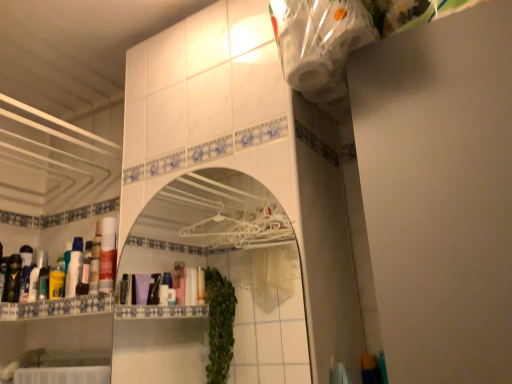
Image resolution: width=512 pixels, height=384 pixels. What do you see at coordinates (73, 274) in the screenshot? I see `white glossy bottle at left, which appears as the second mouthwash when viewed from the left` at bounding box center [73, 274].

Describe the element at coordinates (37, 275) in the screenshot. This screenshot has height=384, width=512. I see `white glossy bottle at left, arranged as the third toiletry when viewed from the left` at that location.

Where is `white plastic mirror at center`? white plastic mirror at center is located at coordinates (233, 264).

Can you tell me how much metallic gold toiletry at left, which is counted as the 1th toiletry, starting from the left, and yellow glossy mouthwash at left, which is counted as the 3th mouthwash, starting from the right, differ in facing direction?

89.7 degrees.

Consider the image. From the image's perspective, which object appears higher, metallic gold toiletry at left, the third toiletry positioned from the right, or yellow glossy mouthwash at left, marked as the first mouthwash in a left-to-right arrangement?

metallic gold toiletry at left, the third toiletry positioned from the right, from the image's perspective.

Between point (17, 273) and point (54, 272), which one is positioned behind?

The point (17, 273) is farther.

Based on the photo, is metallic gold toiletry at left, the third toiletry positioned from the right, not inside yellow glossy mouthwash at left, which is counted as the 3th mouthwash, starting from the right?

Absolutely, metallic gold toiletry at left, the third toiletry positioned from the right, is external to yellow glossy mouthwash at left, which is counted as the 3th mouthwash, starting from the right.

Is white plastic mirror at center directly adjacent to metallic gold toiletry at left, the third toiletry positioned from the right?

No, white plastic mirror at center is not next to metallic gold toiletry at left, the third toiletry positioned from the right.

The height and width of the screenshot is (384, 512). I want to click on mirror to the right of metallic gold toiletry at left, which is counted as the 1th toiletry, starting from the left, so (233, 264).

Is point (279, 329) in front of point (19, 290)?

No, it is behind (19, 290).

Can you see yellow glossy mouthwash at left, marked as the first mouthwash in a left-to-right arrangement, touching matte black lotion at left, which is the 2th toiletry from left to right?

They are not placed beside each other.

Considering the sizes of objects yellow glossy mouthwash at left, which is counted as the 3th mouthwash, starting from the right, and matte black lotion at left, which is the 2th toiletry from left to right, in the image provided, who is wider, yellow glossy mouthwash at left, which is counted as the 3th mouthwash, starting from the right, or matte black lotion at left, which is the 2th toiletry from left to right,?

matte black lotion at left, which is the 2th toiletry from left to right.

Does point (61, 276) lie behind point (27, 273)?

No, (61, 276) is in front of (27, 273).

Does yellow glossy mouthwash at left, which is counted as the 3th mouthwash, starting from the right, turn towards matte black lotion at left, which is the 2th toiletry from left to right?

No, yellow glossy mouthwash at left, which is counted as the 3th mouthwash, starting from the right, is not aimed at matte black lotion at left, which is the 2th toiletry from left to right.

From a real-world perspective, between white plastic mirror at center and white glossy bottle at left, which is counted as the 2th mouthwash, starting from the right, who is vertically higher?

white glossy bottle at left, which is counted as the 2th mouthwash, starting from the right.

From the image's perspective, is white plastic mirror at center located above white glossy bottle at left, which appears as the second mouthwash when viewed from the left?

Correct, white plastic mirror at center appears higher than white glossy bottle at left, which appears as the second mouthwash when viewed from the left, in the image.

Consider the image. Does white plastic mirror at center turn towards white glossy bottle at left, which is counted as the 2th mouthwash, starting from the right?

No.

Considering the sizes of objects white plastic mirror at center and white glossy bottle at left, which is counted as the 2th mouthwash, starting from the right, in the image provided, who is taller, white plastic mirror at center or white glossy bottle at left, which is counted as the 2th mouthwash, starting from the right,?

white plastic mirror at center.

Locate an element on the screen. toiletry below the metallic gold toiletry at left, the third toiletry positioned from the right (from the image's perspective) is located at coordinates (37, 275).

From their relative heights in the image, would you say white glossy bottle at left, arranged as the third toiletry when viewed from the left, is taller or shorter than metallic gold toiletry at left, the third toiletry positioned from the right?

In the image, white glossy bottle at left, arranged as the third toiletry when viewed from the left, appears to be shorter than metallic gold toiletry at left, the third toiletry positioned from the right.

Is white glossy bottle at left, marked as the first toiletry in a right-to-left arrangement, oriented towards metallic gold toiletry at left, which is counted as the 1th toiletry, starting from the left?

No, white glossy bottle at left, marked as the first toiletry in a right-to-left arrangement, is not facing towards metallic gold toiletry at left, which is counted as the 1th toiletry, starting from the left.

Does white glossy bottle at left, marked as the first toiletry in a right-to-left arrangement, have a larger size compared to metallic gold toiletry at left, which is counted as the 1th toiletry, starting from the left?

Actually, white glossy bottle at left, marked as the first toiletry in a right-to-left arrangement, might be smaller than metallic gold toiletry at left, which is counted as the 1th toiletry, starting from the left.

From the image's perspective, is matte black lotion at left, which is the 2th toiletry from left to right, located beneath translucent plastic mouthwash at left, which is counted as the first mouthwash, starting from the right?

Yes, from the image's perspective, matte black lotion at left, which is the 2th toiletry from left to right, is beneath translucent plastic mouthwash at left, which is counted as the first mouthwash, starting from the right.

Is matte black lotion at left, which is the 2th toiletry from left to right, to the left of translucent plastic mouthwash at left, the third mouthwash viewed from the left, from the viewer's perspective?

Yes.

Are matte black lotion at left, which is the 2th toiletry from left to right, and translucent plastic mouthwash at left, the third mouthwash viewed from the left, making contact?

No, matte black lotion at left, which is the 2th toiletry from left to right, is not touching translucent plastic mouthwash at left, the third mouthwash viewed from the left.

Consider the image. Is matte black lotion at left, marked as the 2th toiletry in a right-to-left arrangement, not inside translucent plastic mouthwash at left, the third mouthwash viewed from the left?

Yes, matte black lotion at left, marked as the 2th toiletry in a right-to-left arrangement, is not within translucent plastic mouthwash at left, the third mouthwash viewed from the left.

Can you confirm if translucent plastic mouthwash at left, the third mouthwash viewed from the left, is thinner than white plastic mirror at center?

Incorrect, the width of translucent plastic mouthwash at left, the third mouthwash viewed from the left, is not less than that of white plastic mirror at center.

From the image's perspective, which is above, translucent plastic mouthwash at left, which is counted as the first mouthwash, starting from the right, or white plastic mirror at center?

white plastic mirror at center is shown above in the image.

Who is shorter, translucent plastic mouthwash at left, the third mouthwash viewed from the left, or white plastic mirror at center?

Standing shorter between the two is translucent plastic mouthwash at left, the third mouthwash viewed from the left.

Where is `the 1st mouthwash in front of the metallic gold toiletry at left, the third toiletry positioned from the right, starting your count from the anchor`? The height and width of the screenshot is (384, 512). the 1st mouthwash in front of the metallic gold toiletry at left, the third toiletry positioned from the right, starting your count from the anchor is located at coordinates (56, 282).

Image resolution: width=512 pixels, height=384 pixels. I want to click on the 2nd toiletry below the white plastic mirror at center (from the image's perspective), so click(12, 279).

Considering their positions, is translucent plastic mouthwash at left, which is counted as the first mouthwash, starting from the right, positioned further to matte black lotion at left, which is the 2th toiletry from left to right, than white glossy bottle at left, which appears as the second mouthwash when viewed from the left?

Based on the image, translucent plastic mouthwash at left, which is counted as the first mouthwash, starting from the right, appears to be further to matte black lotion at left, which is the 2th toiletry from left to right.

Which object lies further to the anchor point white glossy bottle at left, which is counted as the 2th mouthwash, starting from the right, matte black lotion at left, marked as the 2th toiletry in a right-to-left arrangement, or white glossy cabinet at lower center?

Among the two, matte black lotion at left, marked as the 2th toiletry in a right-to-left arrangement, is located further to white glossy bottle at left, which is counted as the 2th mouthwash, starting from the right.

In the scene shown: Looking at the image, which one is located further to translucent plastic mouthwash at left, which is counted as the first mouthwash, starting from the right, metallic gold toiletry at left, the third toiletry positioned from the right, or white glossy bottle at left, arranged as the third toiletry when viewed from the left?

metallic gold toiletry at left, the third toiletry positioned from the right, is positioned further to the anchor translucent plastic mouthwash at left, which is counted as the first mouthwash, starting from the right.

Which object lies further to the anchor point white plastic mirror at center, white glossy cabinet at lower center or white glossy bottle at left, arranged as the third toiletry when viewed from the left?

white glossy cabinet at lower center lies further to white plastic mirror at center than the other object.

Which object lies further to the anchor point metallic gold toiletry at left, the third toiletry positioned from the right, matte black lotion at left, marked as the 2th toiletry in a right-to-left arrangement, or white glossy bottle at left, marked as the first toiletry in a right-to-left arrangement?

white glossy bottle at left, marked as the first toiletry in a right-to-left arrangement.

Based on their spatial positions, is white glossy cabinet at lower center or yellow glossy mouthwash at left, marked as the first mouthwash in a left-to-right arrangement, closer to white glossy bottle at left, which is counted as the 2th mouthwash, starting from the right?

The object closer to white glossy bottle at left, which is counted as the 2th mouthwash, starting from the right, is yellow glossy mouthwash at left, marked as the first mouthwash in a left-to-right arrangement.

Which object lies nearer to the anchor point white plastic mirror at center, yellow glossy mouthwash at left, which is counted as the 3th mouthwash, starting from the right, or translucent plastic mouthwash at left, which is counted as the first mouthwash, starting from the right?

translucent plastic mouthwash at left, which is counted as the first mouthwash, starting from the right, is positioned closer to the anchor white plastic mirror at center.

Looking at the image, which one is located closer to white glossy bottle at left, which is counted as the 2th mouthwash, starting from the right, white plastic mirror at center or translucent plastic mouthwash at left, the third mouthwash viewed from the left?

The object closer to white glossy bottle at left, which is counted as the 2th mouthwash, starting from the right, is translucent plastic mouthwash at left, the third mouthwash viewed from the left.

Where is `mouthwash located between matte black lotion at left, which is the 2th toiletry from left to right, and white glossy cabinet at lower center in the left-right direction`? This screenshot has width=512, height=384. mouthwash located between matte black lotion at left, which is the 2th toiletry from left to right, and white glossy cabinet at lower center in the left-right direction is located at coordinates (56, 282).

The image size is (512, 384). I want to click on mouthwash between white plastic mirror at center and white glossy bottle at left, which appears as the second mouthwash when viewed from the left, in the front-back direction, so click(108, 255).

At what (x,y) coordinates should I click in order to perform the action: click on cabinet located between metallic gold toiletry at left, the third toiletry positioned from the right, and white glossy bottle at left, which appears as the second mouthwash when viewed from the left, in the left-right direction. Please return your answer as a coordinate pair (x, y). This screenshot has width=512, height=384. Looking at the image, I should click on (57, 307).

This screenshot has width=512, height=384. In order to click on cabinet situated between metallic gold toiletry at left, which is counted as the 1th toiletry, starting from the left, and white plastic mirror at center from left to right in this screenshot , I will do `click(57, 307)`.